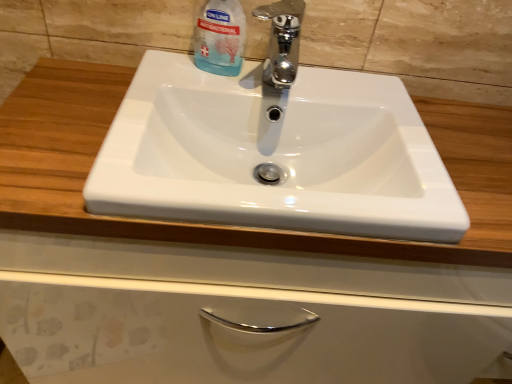
Locate an element on the screen. The width and height of the screenshot is (512, 384). free space to the left of chrome metallic faucet at center is located at coordinates (185, 91).